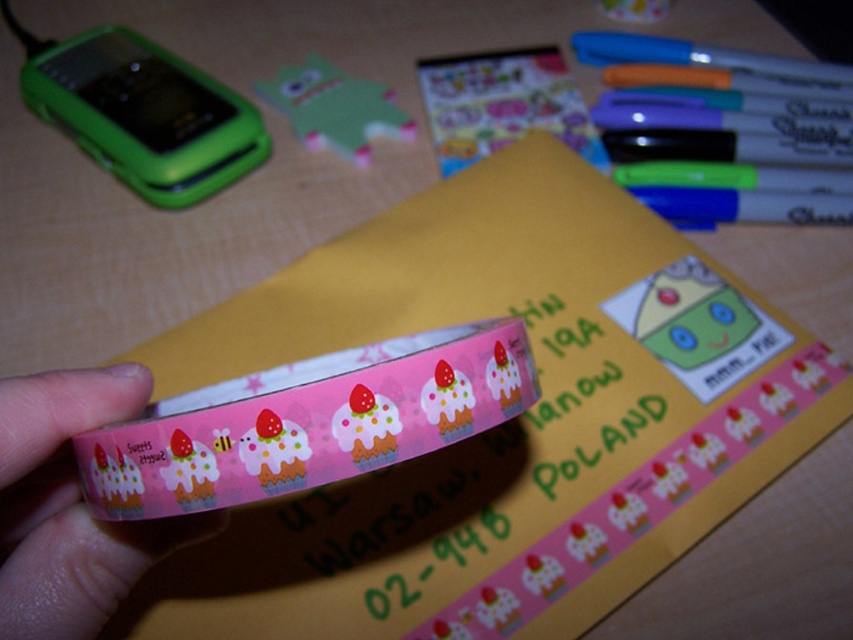
What is located at the point marked by coordinates (70, 506) in the image?

The point marked by coordinates (70, 506) is located at the pink glossy tape at center.

You are organizing items on a desk and need to place a new sticker. There are two points marked on the desk surface labeled as point [589,140] and point [759,214]. According to the image, which point is closer to you, the observer?

Point [759,214] is closer to you because point [589,140] is behind it.

You need to place a sticker on the desk between the pink glossy tape at center and the green matte phone at upper left. Based on their positions, where should you place it?

The pink glossy tape at center is located below the green matte phone at upper left, so placing the sticker between them would require positioning it somewhere between the lower area of the green matte phone at upper left and the upper part of the pink glossy tape at center.